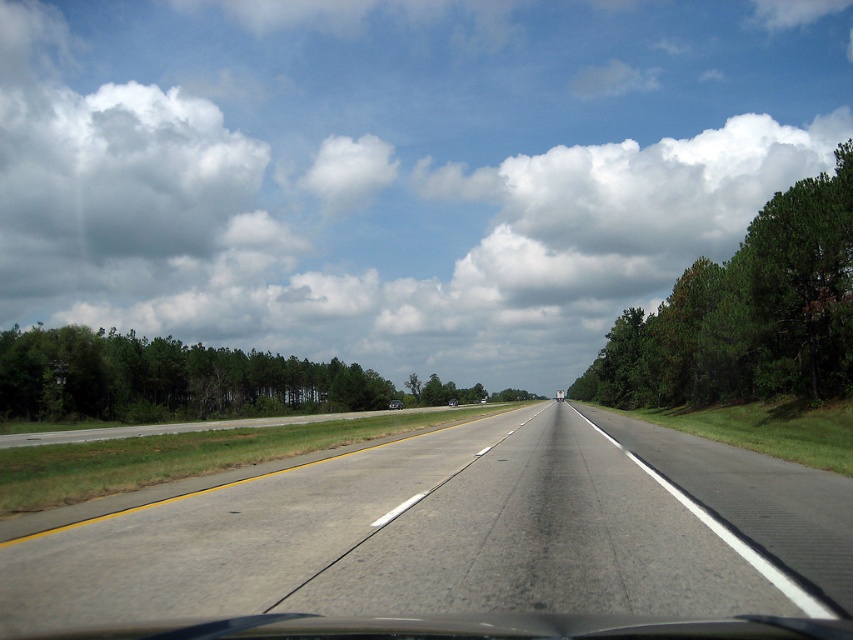
Question: Does green leafy tree at right appear under matte black truck at center?

Choices:
 (A) no
 (B) yes

Answer: (A)

Question: Among these objects, which one is farthest from the camera?

Choices:
 (A) black glossy sedan at center
 (B) matte black truck at center
 (C) gray asphalt highway at center

Answer: (B)

Question: Which point is closer to the camera?

Choices:
 (A) (451, 404)
 (B) (368, 486)
 (C) (679, 323)
 (D) (392, 404)

Answer: (B)

Question: Can you confirm if white fluffy cloud at upper center is positioned above matte black truck at center?

Choices:
 (A) yes
 (B) no

Answer: (A)

Question: Is gray asphalt highway at center smaller than green leafy trees at left?

Choices:
 (A) yes
 (B) no

Answer: (A)

Question: Among these points, which one is farthest from the camera?

Choices:
 (A) 323,378
 (B) 193,164
 (C) 456,397

Answer: (B)